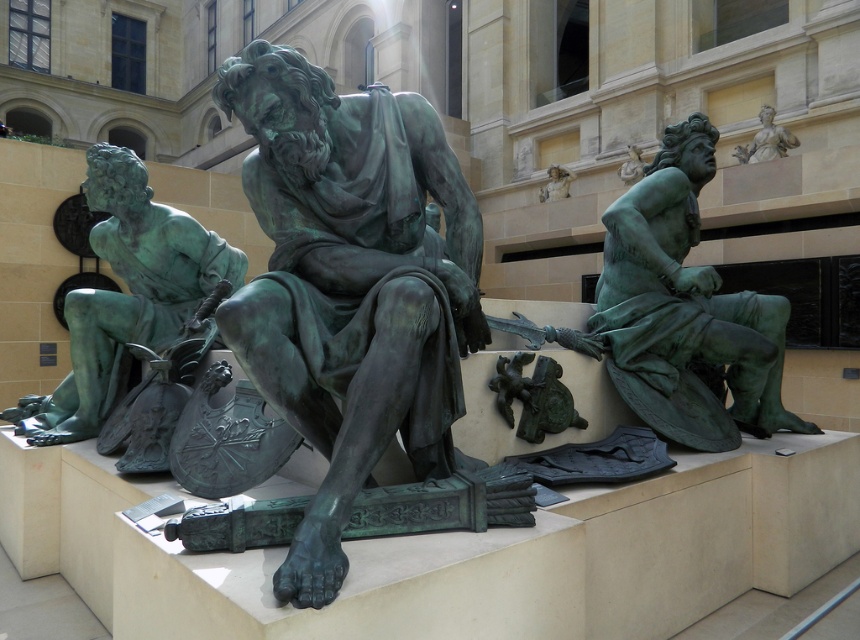
Question: Observing the image, what is the correct spatial positioning of green patina statue at right in reference to green patina statue at left?

Choices:
 (A) below
 (B) above

Answer: (B)

Question: Among these points, which one is nearest to the camera?

Choices:
 (A) (650, 321)
 (B) (760, 124)

Answer: (A)

Question: Which of the following is the closest to the observer?

Choices:
 (A) green patina statue at upper right
 (B) green patina statue at right

Answer: (B)

Question: In this image, where is green patina statue at left located relative to green patina statue at upper right?

Choices:
 (A) above
 (B) below

Answer: (B)

Question: Can you confirm if green patina statue at right is positioned to the left of green patina statue at left?

Choices:
 (A) yes
 (B) no

Answer: (B)

Question: Which of these objects is positioned closest to the green patina statue at center?

Choices:
 (A) green patina statue at left
 (B) green patina statue at upper right

Answer: (A)